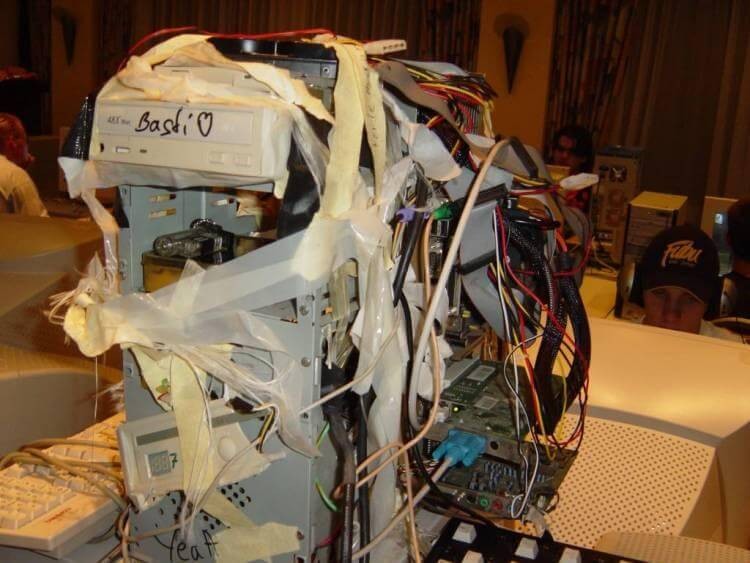
Where is `cords`? The width and height of the screenshot is (750, 563). cords is located at coordinates (442, 271), (390, 528), (57, 461), (64, 441).